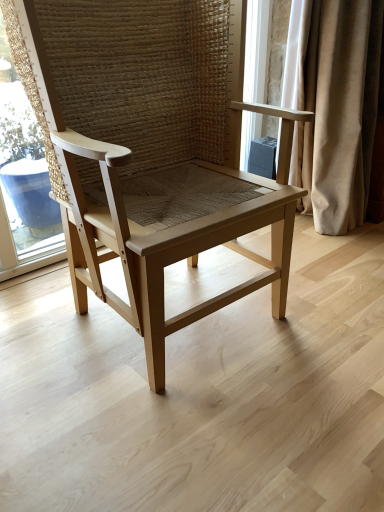
Question: Can you confirm if light wood chair at center is smaller than beige fabric curtain at right?

Choices:
 (A) no
 (B) yes

Answer: (A)

Question: Can you confirm if light wood chair at center is positioned to the left of beige fabric curtain at right?

Choices:
 (A) yes
 (B) no

Answer: (A)

Question: Would you say light wood chair at center contains beige fabric curtain at right?

Choices:
 (A) no
 (B) yes

Answer: (A)

Question: Would you say light wood chair at center is outside beige fabric curtain at right?

Choices:
 (A) yes
 (B) no

Answer: (A)

Question: Can you confirm if light wood chair at center is wider than beige fabric curtain at right?

Choices:
 (A) no
 (B) yes

Answer: (B)

Question: Can you confirm if light wood chair at center is bigger than beige fabric curtain at right?

Choices:
 (A) no
 (B) yes

Answer: (B)

Question: From a real-world perspective, is beige fabric curtain at right on top of light wood chair at center?

Choices:
 (A) no
 (B) yes

Answer: (B)

Question: Is light wood chair at center at the back of beige fabric curtain at right?

Choices:
 (A) yes
 (B) no

Answer: (B)

Question: Considering the relative sizes of beige fabric curtain at right and light wood chair at center in the image provided, is beige fabric curtain at right wider than light wood chair at center?

Choices:
 (A) yes
 (B) no

Answer: (B)

Question: Is beige fabric curtain at right behind light wood chair at center?

Choices:
 (A) yes
 (B) no

Answer: (A)

Question: Is beige fabric curtain at right taller than light wood chair at center?

Choices:
 (A) no
 (B) yes

Answer: (B)

Question: From a real-world perspective, is beige fabric curtain at right below light wood chair at center?

Choices:
 (A) no
 (B) yes

Answer: (A)

Question: From a real-world perspective, is light wood chair at center positioned above or below beige fabric curtain at right?

Choices:
 (A) above
 (B) below

Answer: (B)